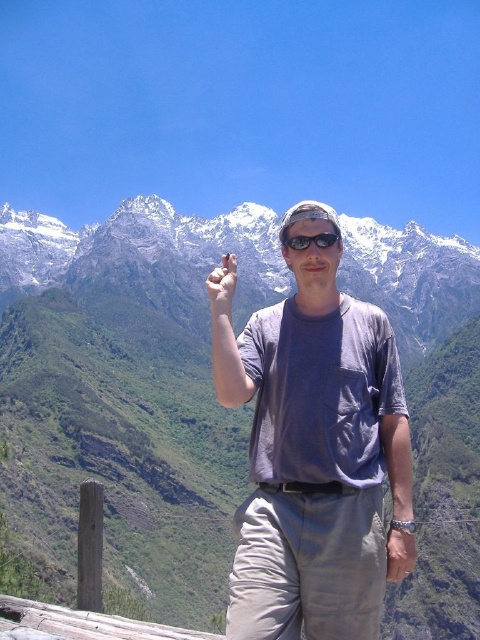
Question: Which point is closer to the camera?

Choices:
 (A) green grassy mountain at upper center
 (B) gray cotton t-shirt at center
 (C) snowy mountain range at upper center

Answer: (B)

Question: Is snowy mountain range at upper center to the left of gray cotton t-shirt at center from the viewer's perspective?

Choices:
 (A) yes
 (B) no

Answer: (A)

Question: Is gray cotton t-shirt at center to the left of black matte sunglasses at center from the viewer's perspective?

Choices:
 (A) yes
 (B) no

Answer: (A)

Question: Among these objects, which one is farthest from the camera?

Choices:
 (A) black matte sunglasses at center
 (B) green grassy mountain at upper center

Answer: (B)

Question: Among these objects, which one is nearest to the camera?

Choices:
 (A) black matte sunglasses at center
 (B) snowy mountain range at upper center

Answer: (A)

Question: Can you confirm if snowy mountain range at upper center is smaller than snowy granite mountain range at upper center?

Choices:
 (A) no
 (B) yes

Answer: (B)